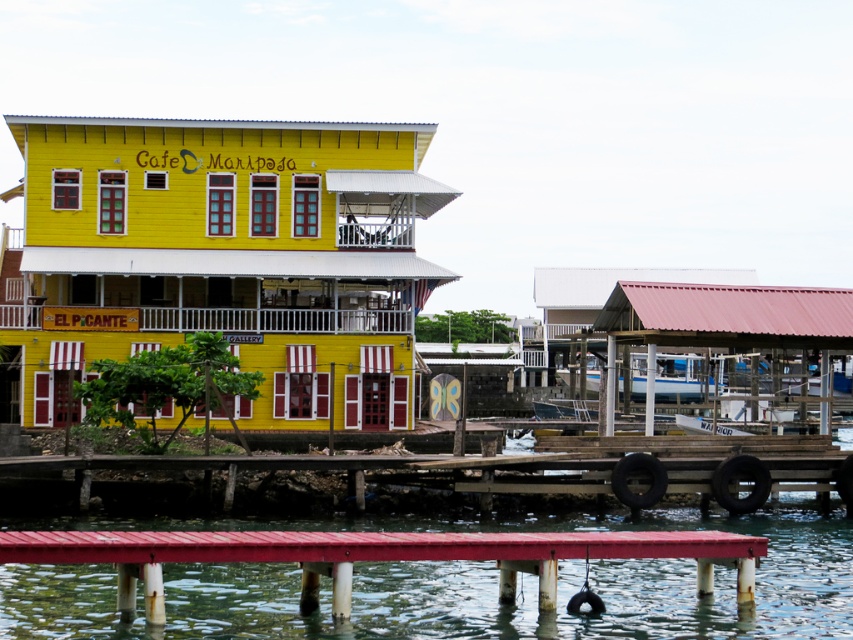
Question: Is smooth water at lower center below white glossy boat at center?

Choices:
 (A) yes
 (B) no

Answer: (A)

Question: Which point appears farthest from the camera in this image?

Choices:
 (A) (10, 573)
 (B) (619, 358)

Answer: (B)

Question: Is smooth water at lower center to the right of white glossy boat at center from the viewer's perspective?

Choices:
 (A) yes
 (B) no

Answer: (B)

Question: Which object appears closest to the camera in this image?

Choices:
 (A) white glossy boat at center
 (B) smooth water at lower center

Answer: (B)

Question: Which point appears closest to the camera in this image?

Choices:
 (A) (675, 396)
 (B) (282, 627)

Answer: (B)

Question: Is smooth water at lower center positioned behind white glossy boat at center?

Choices:
 (A) no
 (B) yes

Answer: (A)